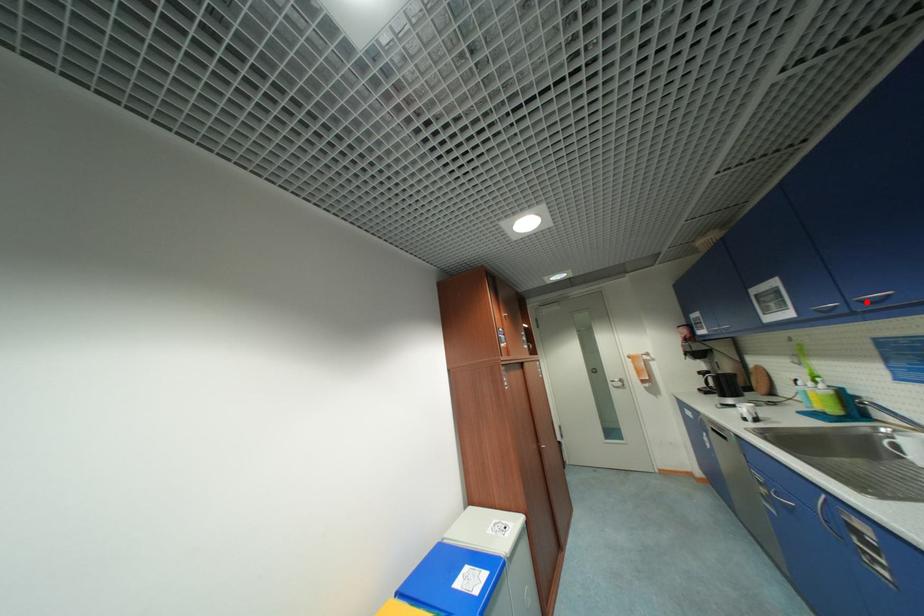
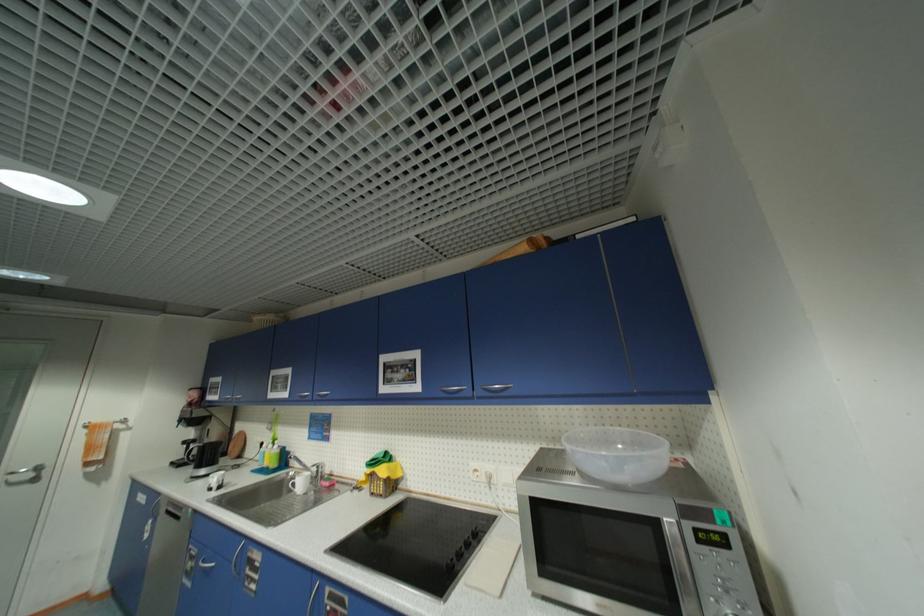
Question: I am providing you with two images of the same scene from different viewpoints. A red point is shown in image1. For the corresponding object point in image2, is it positioned nearer or farther from the camera?

Choices:
 (A) Nearer
 (B) Farther

Answer: (B)